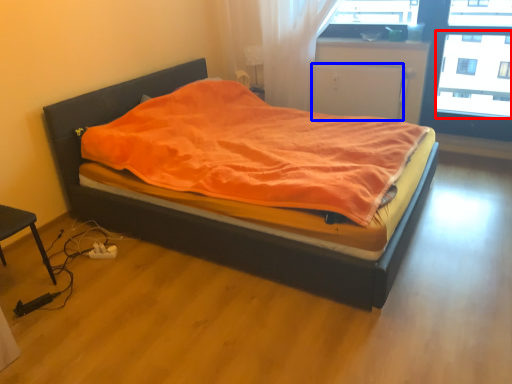
Question: Among these objects, which one is farthest to the camera, window screen (highlighted by a red box) or screen door (highlighted by a blue box)?

Choices:
 (A) window screen
 (B) screen door

Answer: (B)